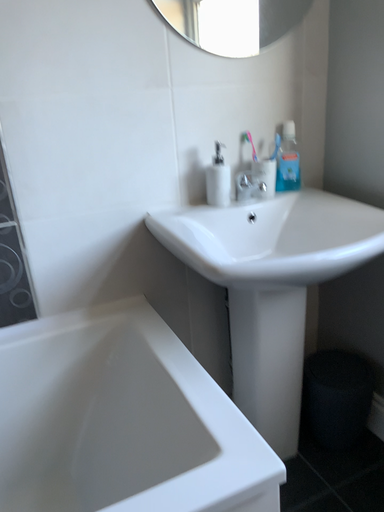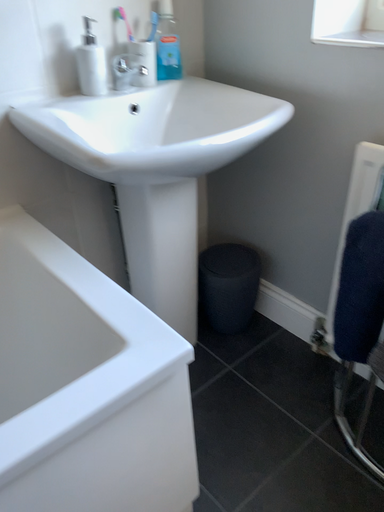
Question: How did the camera likely rotate when shooting the video?

Choices:
 (A) rotated upward
 (B) rotated downward

Answer: (B)